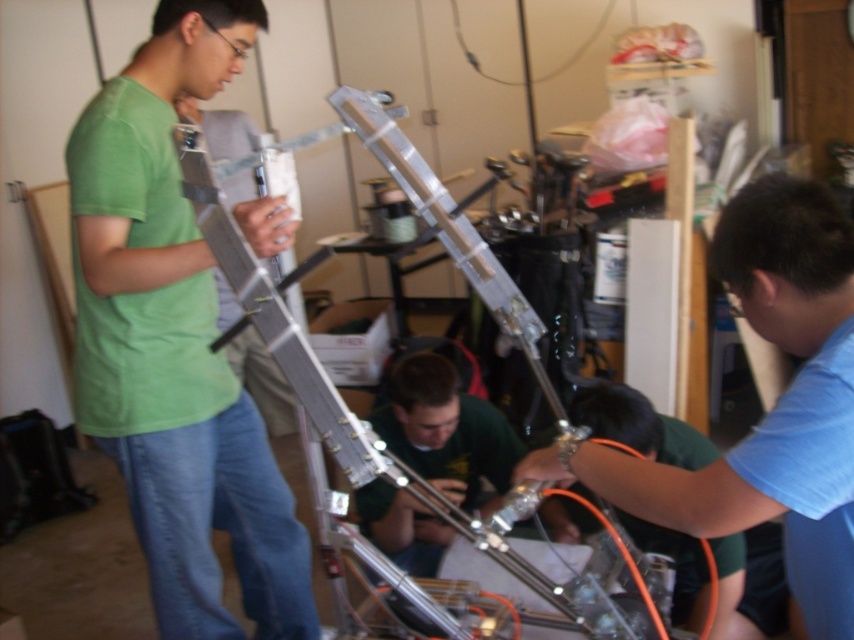
Does blue matte shirt at lower right appear over green fabric shirt at center?

Yes.

Between blue matte shirt at lower right and green fabric shirt at center, which one appears on the left side from the viewer's perspective?

From the viewer's perspective, green fabric shirt at center appears more on the left side.

Between point (726, 484) and point (452, 452), which one is positioned behind?

The point (452, 452) is behind.

Where is `blue matte shirt at lower right`? blue matte shirt at lower right is located at coordinates (771, 408).